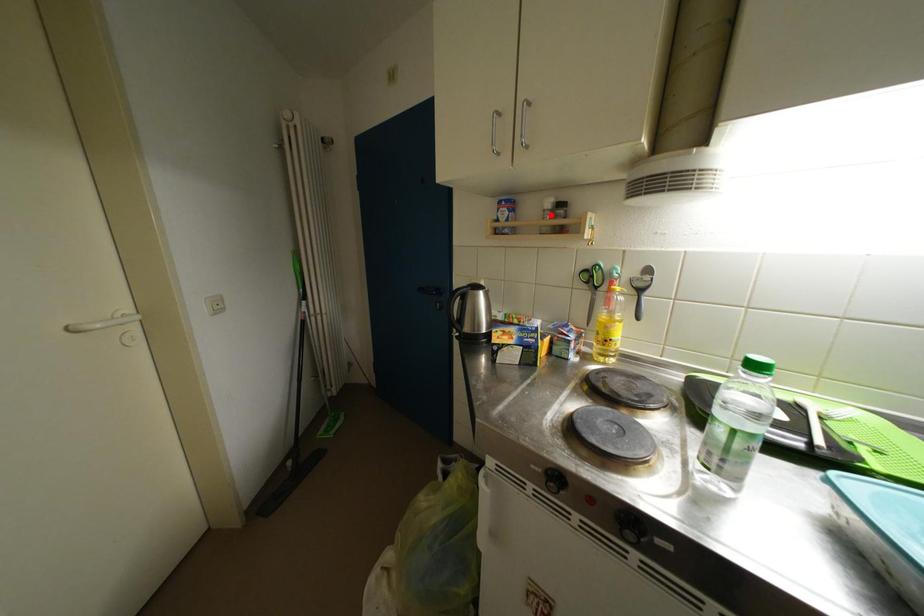
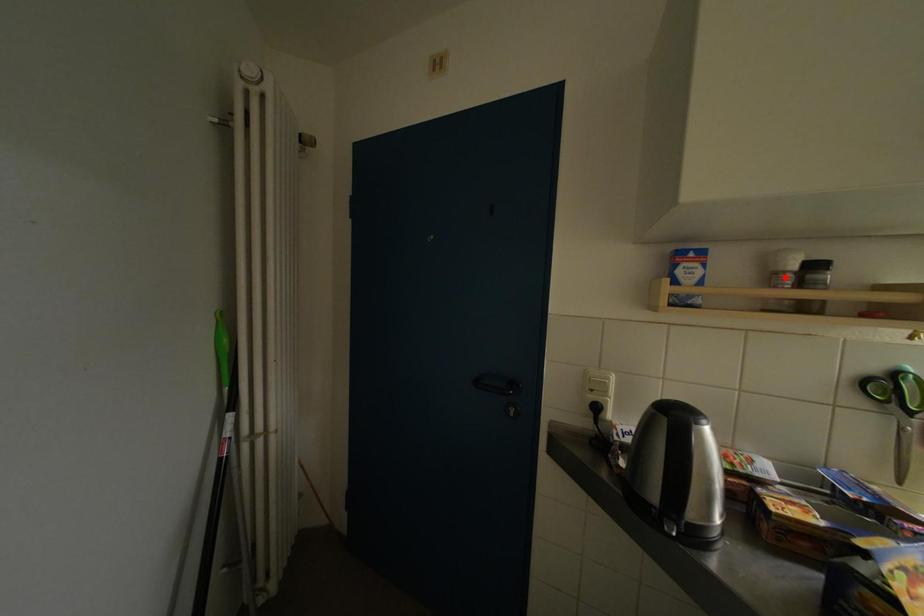
I am providing you with two images of the same scene from different viewpoints. A red point is marked on the first image and another point is marked on the second image. Does the point marked in image1 correspond to the same location as the one in image2?

Yes